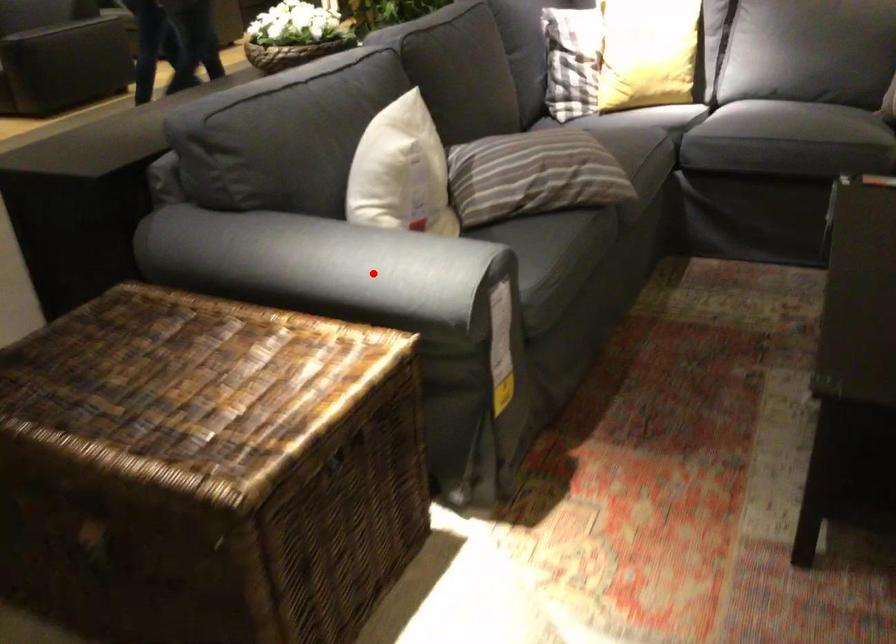
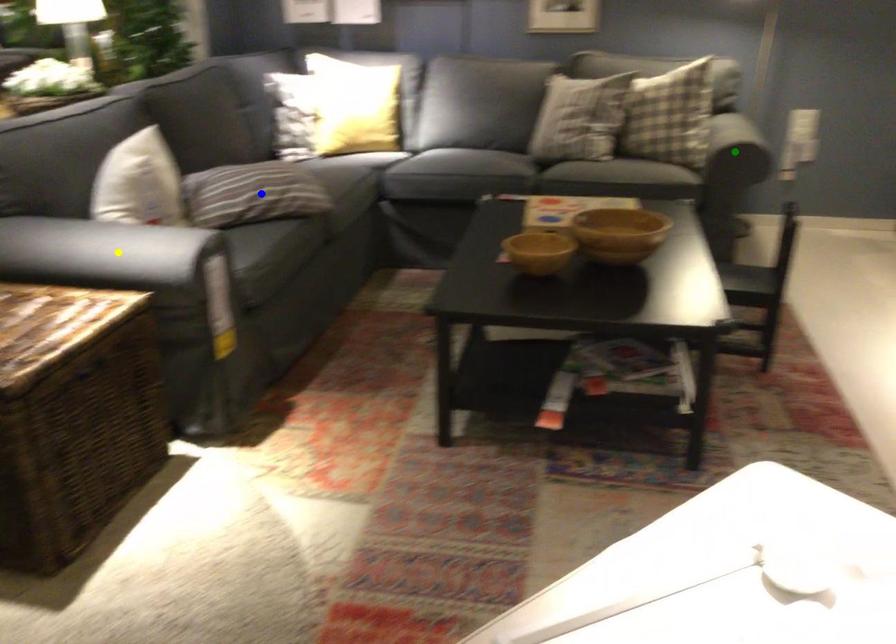
Question: I am providing you with two images of the same scene from different viewpoints. A red point is marked on the first image. You are given multiple points on the second image. Can you choose the point in image 2 that corresponds to the point in image 1?

Choices:
 (A) blue point
 (B) yellow point
 (C) green point

Answer: (B)